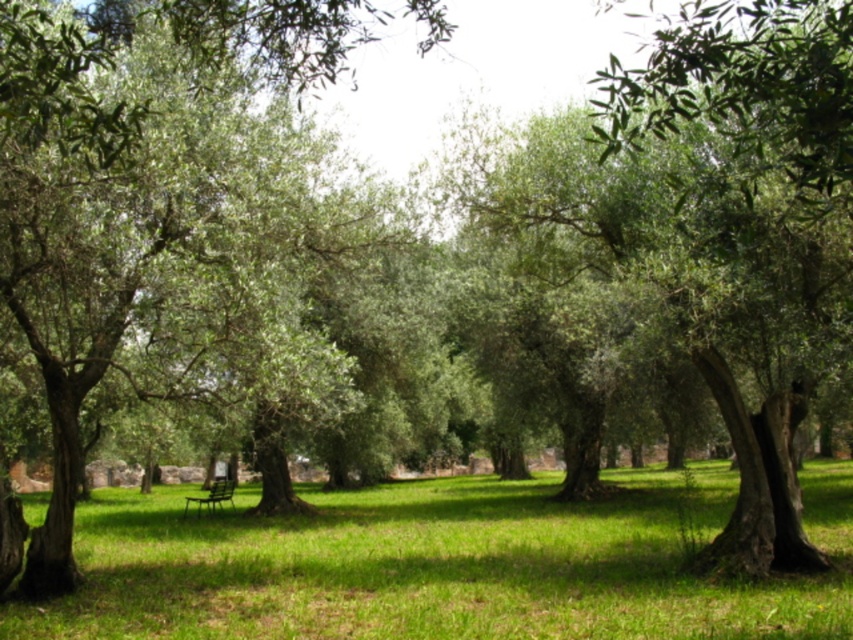
You are planning to sit on the metallic green bench at center to enjoy the olive grove view. However, you have a picnic blanket that is 2 meters wide. Can you spread the blanket on the green grassy field at center without overlapping the bench?

The green grassy field at center is to the right of metallic green bench at center. Since the field is adjacent and positioned to the right, you can spread the picnic blanket on the green grassy field at center as long as you place it to the right side of the bench, ensuring it doesn not overlap.

You are planning to install a small garden path between the green grassy field at center and the metallic green bench at center. The path requires a minimum of 5 meters of space. Can the existing distance accommodate the path?

The green grassy field at center is 7.83 meters from the metallic green bench at center, which is more than the required 5 meters, so the path can be installed between them.